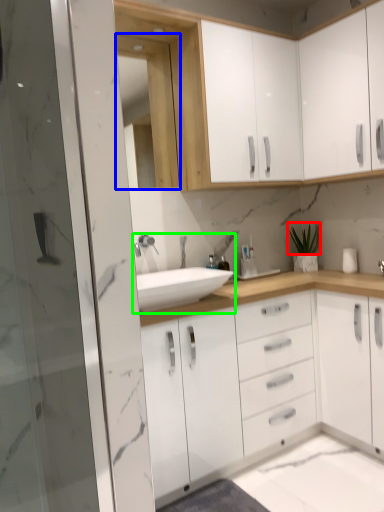
Question: Which is farther away from plant (highlighted by a red box)? medicine cabinet (highlighted by a blue box) or sink (highlighted by a green box)?

Choices:
 (A) medicine cabinet
 (B) sink

Answer: (A)